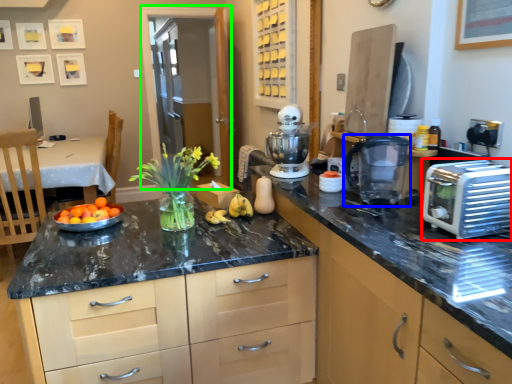
Question: Which is nearer to the toaster (highlighted by a red box)? kitchen appliance (highlighted by a blue box) or glass door (highlighted by a green box).

Choices:
 (A) kitchen appliance
 (B) glass door

Answer: (A)